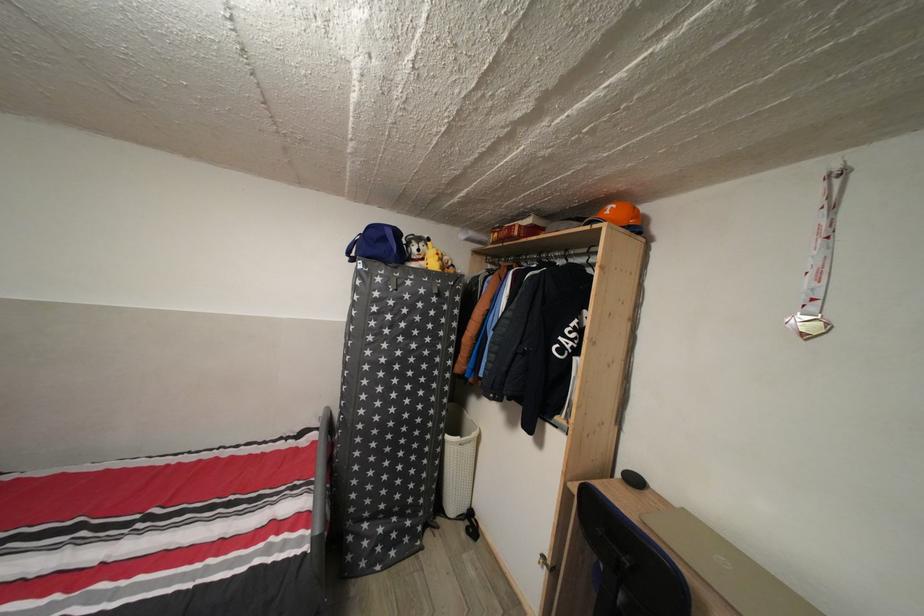
Find where to lift the red cardboard box. Please return your answer as a coordinate pair (x, y).

(517, 229)